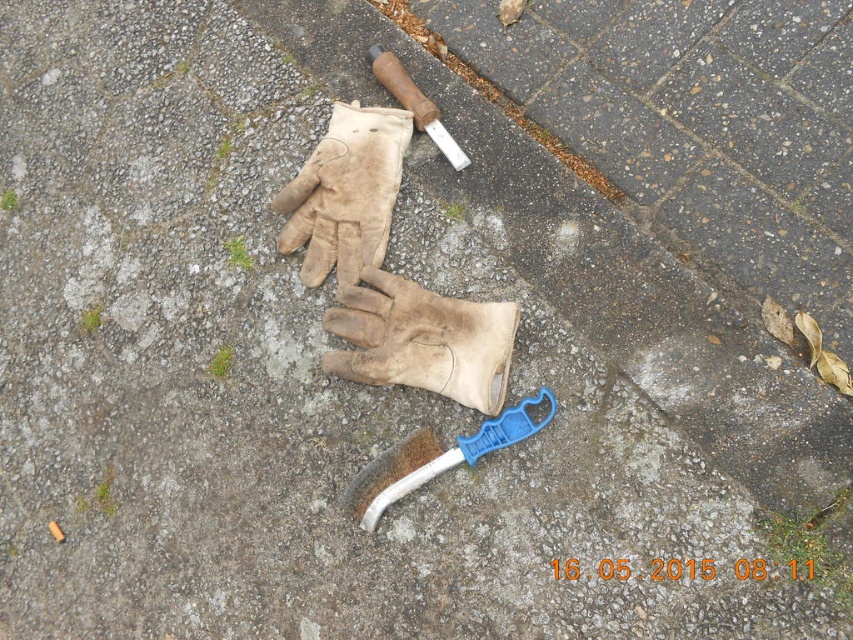
You are a maintenance worker who needs to reach both the blue plastic shovel at center and the wooden handle knife at upper center quickly. Given that your reach is 24 inches, can you grab both items without moving your position?

The blue plastic shovel at center and wooden handle knife at upper center are 24.27 inches apart. Since your reach is 24 inches, you cannot grab both items without moving your position because the distance between them exceeds your reach.

You are organizing a tool shed and need to place the leather at center and the blue plastic shovel at center into a storage box. The box can only fit one of them. Based on their sizes, which object should you prioritize placing first?

The leather at center is bigger than the blue plastic shovel at center, so you should prioritize placing the leather at center first to ensure it fits in the storage box.